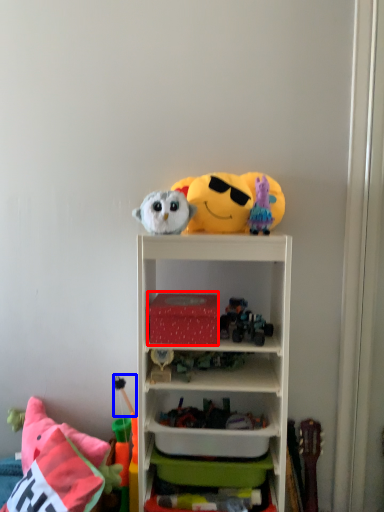
Question: Which point is closer to the camera, storage box (highlighted by a red box) or toy (highlighted by a blue box)?

Choices:
 (A) storage box
 (B) toy

Answer: (A)